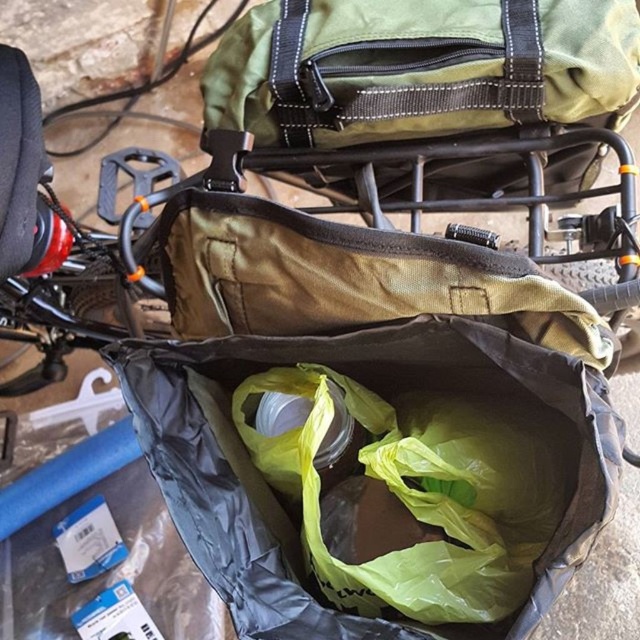
What is located at the coordinates point (360, 387) in the image?

The point (360, 387) indicates a matte brown fabric bag at center.

Based on the photo, you are organizing items on a bicycle rack and need to place the matte brown fabric bag at center and the matte green fabric baby carriage at upper center. Based on their positions, which one is positioned to the right side?

The matte brown fabric bag at center is positioned to the right of the matte green fabric baby carriage at upper center.